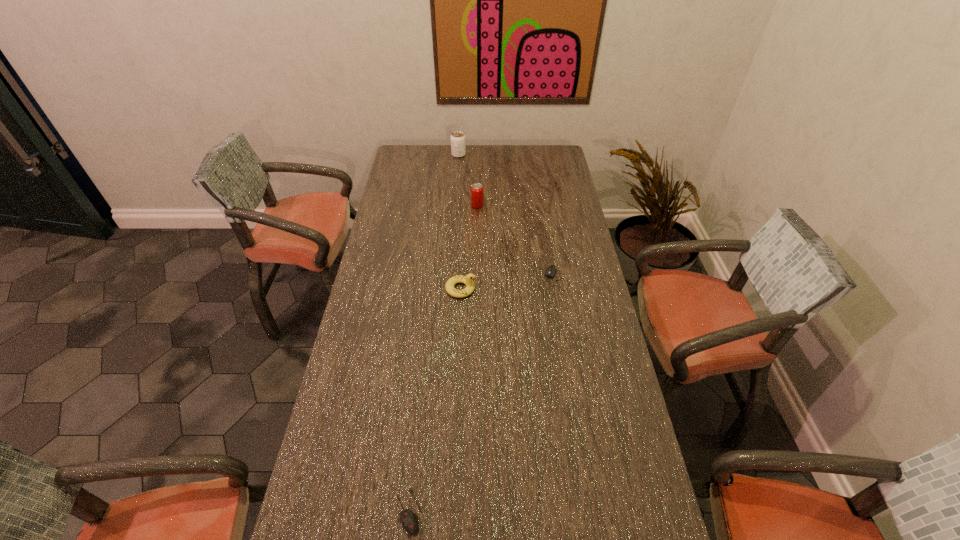
Identify the location of vacant space that satisfies the following two spatial constraints: 1. on the front side of the farthest object; 2. on the left side of the can. (455, 205).